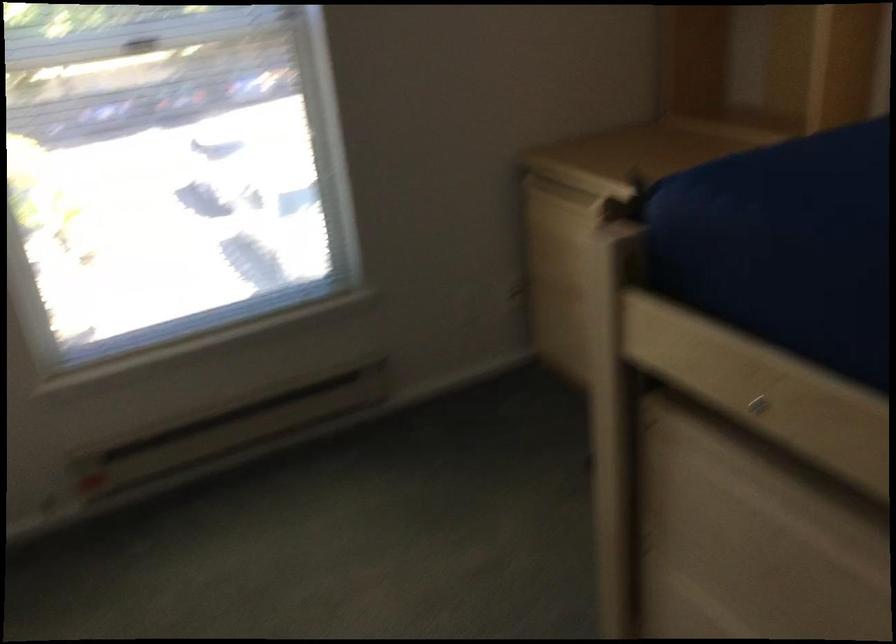
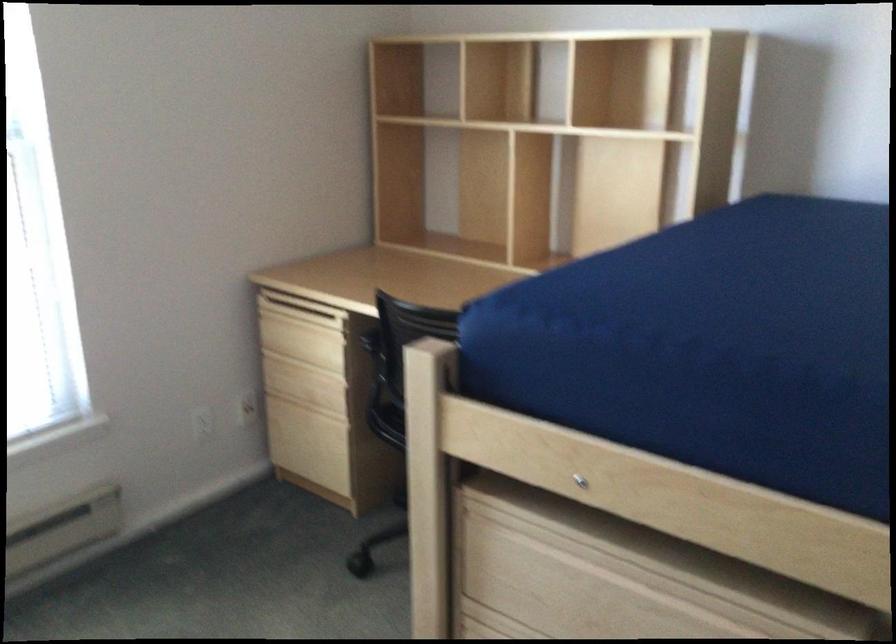
Question: The images are taken continuously from a first-person perspective. In which direction is your viewpoint rotating?

Choices:
 (A) Left
 (B) Right
 (C) Up
 (D) Down

Answer: (B)